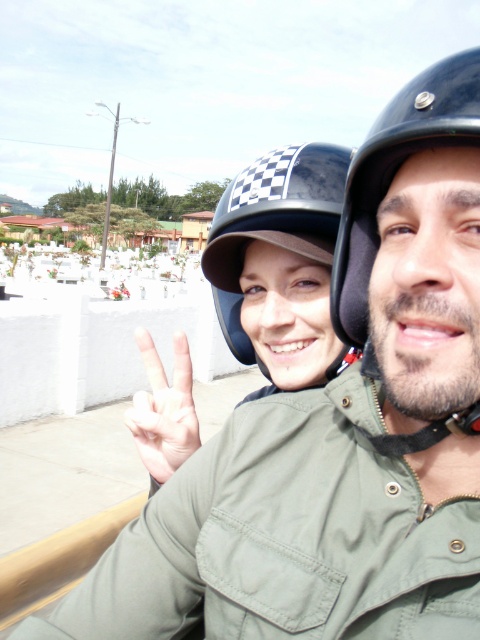
Describe the element at coordinates (396, 172) in the screenshot. This screenshot has width=480, height=640. I see `black matte helmet at center` at that location.

Which is in front, point (417, 109) or point (230, 308)?

Point (417, 109) is more forward.

Where is `black matte helmet at center`? The width and height of the screenshot is (480, 640). black matte helmet at center is located at coordinates (396, 172).

Between black matte helmet at center and pale skin/soft flesh hand at center, which one appears on the left side from the viewer's perspective?

pale skin/soft flesh hand at center

From the picture: Does black matte helmet at center appear on the right side of pale skin/soft flesh hand at center?

Correct, you'll find black matte helmet at center to the right of pale skin/soft flesh hand at center.

What are the coordinates of `black matte helmet at center` in the screenshot? It's located at (396, 172).

Can you confirm if checkerboard-patterned helmet at center is smaller than pale skin/soft flesh hand at center?

Actually, checkerboard-patterned helmet at center might be larger than pale skin/soft flesh hand at center.

Does point (297, 173) lie behind point (155, 480)?

No, it is not.

Image resolution: width=480 pixels, height=640 pixels. What are the coordinates of `checkerboard-patterned helmet at center` in the screenshot? It's located at (273, 224).